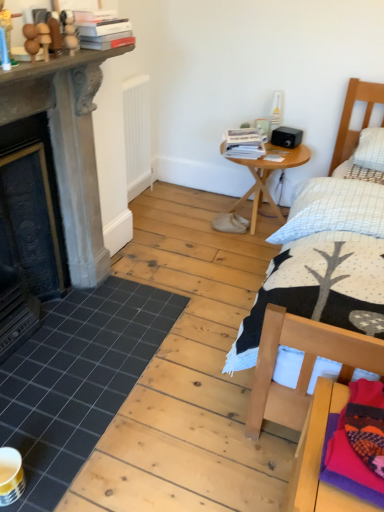
Describe the element at coordinates (105, 33) in the screenshot. I see `hardcover book at upper left, the 1th book when ordered from left to right` at that location.

This screenshot has width=384, height=512. What are the coordinates of `knitted woolen blanket at lower right` in the screenshot? It's located at (335, 496).

Image resolution: width=384 pixels, height=512 pixels. What do you see at coordinates (244, 143) in the screenshot?
I see `white paper stack at upper right, the first book positioned from the right` at bounding box center [244, 143].

Where is `wooden round table at center`? wooden round table at center is located at coordinates (268, 176).

Is black tile at lower left not within hardcover book at upper left, arranged as the first book when viewed from the front?

Absolutely, black tile at lower left is external to hardcover book at upper left, arranged as the first book when viewed from the front.

Can you confirm if black tile at lower left is taller than hardcover book at upper left, arranged as the first book when viewed from the front?

No.

Where is `tile below the hardcover book at upper left, which ranks as the third book in right-to-left order (from a real-world perspective)`? The width and height of the screenshot is (384, 512). tile below the hardcover book at upper left, which ranks as the third book in right-to-left order (from a real-world perspective) is located at coordinates (78, 379).

Which object is thinner, black tile at lower left or hardcover book at upper left, the 3th book from the back?

Thinner between the two is hardcover book at upper left, the 3th book from the back.

Based on their sizes in the image, would you say white matte radiator at center is bigger or smaller than black tile at lower left?

Considering their sizes, white matte radiator at center takes up more space than black tile at lower left.

Considering the positions of objects white matte radiator at center and black tile at lower left in the image provided, who is more to the right, white matte radiator at center or black tile at lower left?

white matte radiator at center is more to the right.

Is white matte radiator at center in front of black tile at lower left?

No, the depth of white matte radiator at center is greater than that of black tile at lower left.

Is wooden bed at right oriented towards white matte radiator at center?

No, wooden bed at right is not facing towards white matte radiator at center.

Who is taller, wooden bed at right or white matte radiator at center?

With more height is wooden bed at right.

Considering the positions of points (376, 253) and (123, 84), is point (376, 253) closer to camera compared to point (123, 84)?

Yes, point (376, 253) is closer to viewer.

What's the angular difference between wooden bed at right and white matte radiator at center's facing directions?

The angular difference between wooden bed at right and white matte radiator at center is 89.9 degrees.

Is white paper book at upper center, the second book in the left-to-right sequence, completely or partially inside white paper stack at upper right, the first book positioned from the right?

No.

Is white paper stack at upper right, placed as the third book when sorted from left to right, taller than white paper book at upper center, the second book viewed from the back?

Indeed, white paper stack at upper right, placed as the third book when sorted from left to right, has a greater height compared to white paper book at upper center, the second book viewed from the back.

From the picture: Can you confirm if white paper stack at upper right, which ranks as the first book in back-to-front order, is thinner than white paper book at upper center, marked as the 2th book in a front-to-back arrangement?

Correct, the width of white paper stack at upper right, which ranks as the first book in back-to-front order, is less than that of white paper book at upper center, marked as the 2th book in a front-to-back arrangement.

From a real-world perspective, which object stands above the other?

white paper book at upper center, marked as the 2th book in a front-to-back arrangement.

In the scene shown: From a real-world perspective, between wooden round table at center and white paper stack at upper right, which ranks as the first book in back-to-front order, who is vertically higher?

In real-world perspective, white paper stack at upper right, which ranks as the first book in back-to-front order, is above.

The height and width of the screenshot is (512, 384). In order to click on the 2nd book behind the wooden round table at center, starting your count from the anchor in this screenshot , I will do `click(244, 143)`.

Who is smaller, wooden round table at center or white paper stack at upper right, which ranks as the first book in back-to-front order?

Smaller between the two is white paper stack at upper right, which ranks as the first book in back-to-front order.

Considering the relative positions of wooden round table at center and white paper stack at upper right, the first book positioned from the right, in the image provided, is wooden round table at center to the right of white paper stack at upper right, the first book positioned from the right, from the viewer's perspective?

Indeed, wooden round table at center is positioned on the right side of white paper stack at upper right, the first book positioned from the right.

Based on the photo, does knitted woolen blanket at lower right have a lesser height compared to white matte radiator at center?

Yes.

Considering the positions of point (356, 501) and point (126, 124), is point (356, 501) closer or farther from the camera than point (126, 124)?

Point (356, 501) is positioned closer to the camera compared to point (126, 124).

Consider the image. How far apart are knitted woolen blanket at lower right and white matte radiator at center?

They are 2.23 meters apart.

Is knitted woolen blanket at lower right in contact with white matte radiator at center?

knitted woolen blanket at lower right and white matte radiator at center are clearly separated.

The image size is (384, 512). Find the location of `tile below the knitted woolen blanket at lower right (from a real-world perspective)`. tile below the knitted woolen blanket at lower right (from a real-world perspective) is located at coordinates (78, 379).

Considering the relative sizes of black tile at lower left and knitted woolen blanket at lower right in the image provided, is black tile at lower left bigger than knitted woolen blanket at lower right?

Yes.

From a real-world perspective, between black tile at lower left and knitted woolen blanket at lower right, who is vertically lower?

black tile at lower left, from a real-world perspective.

Between black tile at lower left and knitted woolen blanket at lower right, which one is positioned in front?

Positioned in front is knitted woolen blanket at lower right.

Which book is the 1st one when counting from the back of the black tile at lower left? Please provide its 2D coordinates.

[(105, 33)]

Where is `tile located on the left of white matte radiator at center`? The width and height of the screenshot is (384, 512). tile located on the left of white matte radiator at center is located at coordinates (78, 379).

Considering their positions, is dark gray stone fireplace at left positioned further to white matte radiator at center than white paper stack at upper right, the first book positioned from the right?

The object further to white matte radiator at center is dark gray stone fireplace at left.

Based on their spatial positions, is wooden bed at right or knitted woolen blanket at lower right closer to white matte radiator at center?

wooden bed at right.

Based on their spatial positions, is hardcover book at upper left, which ranks as the third book in right-to-left order, or white paper book at upper center, the second book viewed from the back, closer to wooden round table at center?

white paper book at upper center, the second book viewed from the back, is positioned closer to the anchor wooden round table at center.

Estimate the real-world distances between objects in this image. Which object is further from dark gray stone fireplace at left, knitted woolen blanket at lower right or white paper stack at upper right, the first book positioned from the right?

knitted woolen blanket at lower right is positioned further to the anchor dark gray stone fireplace at left.

When comparing their distances from wooden round table at center, does white paper stack at upper right, placed as the third book when sorted from left to right, or knitted woolen blanket at lower right seem further?

knitted woolen blanket at lower right is further to wooden round table at center.

Which object lies nearer to the anchor point black tile at lower left, knitted woolen blanket at lower right or hardcover book at upper left, arranged as the first book when viewed from the front?

knitted woolen blanket at lower right lies closer to black tile at lower left than the other object.

Looking at the image, which one is located closer to white paper stack at upper right, which ranks as the first book in back-to-front order, hardcover book at upper left, which ranks as the third book in right-to-left order, or wooden bed at right?

wooden bed at right is positioned closer to the anchor white paper stack at upper right, which ranks as the first book in back-to-front order.

Looking at the image, which one is located further to hardcover book at upper left, the 3th book from the back, wooden bed at right or white paper book at upper center, the second book in the left-to-right sequence?

wooden bed at right is positioned further to the anchor hardcover book at upper left, the 3th book from the back.

What are the coordinates of `book between dark gray stone fireplace at left and white paper book at upper center, the second book in the left-to-right sequence, in the front-back direction` in the screenshot? It's located at (105, 33).

Locate an element on the screen. This screenshot has height=512, width=384. radiator positioned between knitted woolen blanket at lower right and white paper stack at upper right, positioned as the 3th book in front-to-back order, from near to far is located at coordinates (137, 135).

Locate an element on the screen. bed positioned between knitted woolen blanket at lower right and wooden round table at center from near to far is located at coordinates (315, 290).

The width and height of the screenshot is (384, 512). Identify the location of tile positioned between dark gray stone fireplace at left and white matte radiator at center from near to far. (78, 379).